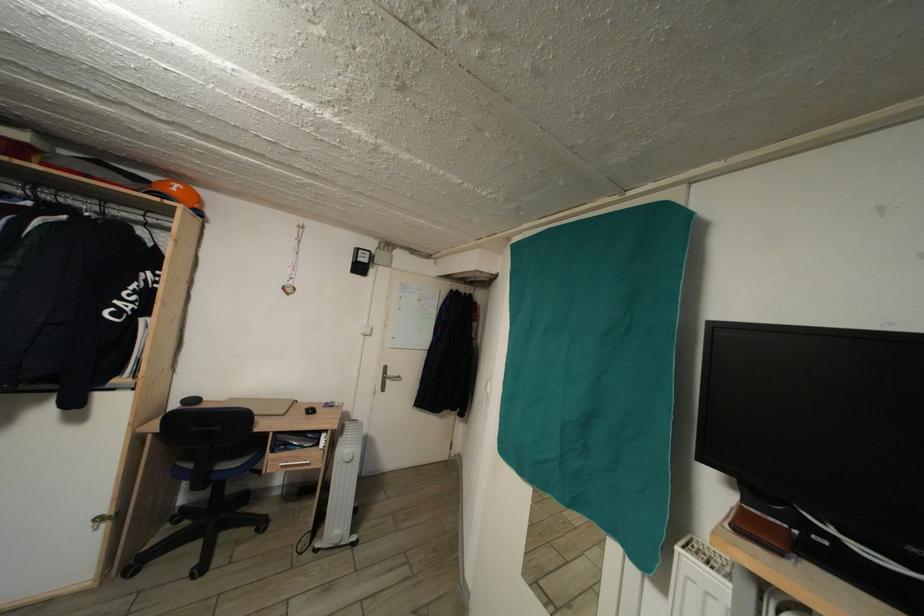
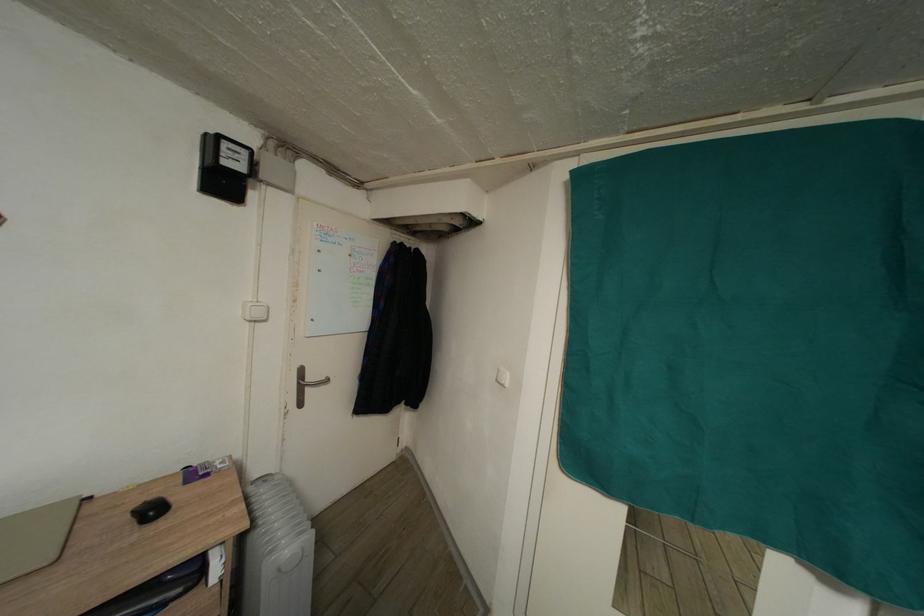
Question: The images are taken continuously from a first-person perspective. In which direction is your viewpoint rotating?

Choices:
 (A) Left
 (B) Right
 (C) Up
 (D) Down

Answer: (B)